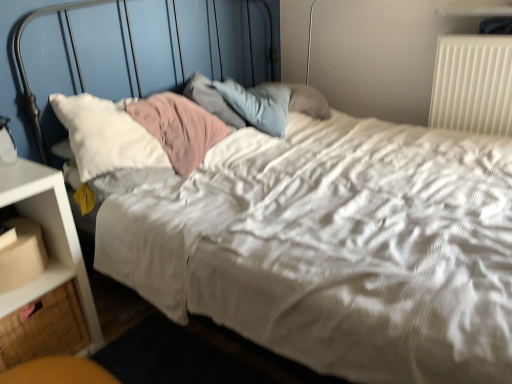
In order to face beige fabric drawer at lower left, should I rotate leftwards or rightwards?

To face it directly, rotate left by 28.556 degrees.

This screenshot has width=512, height=384. I want to click on beige fabric drawer at lower left, so click(x=42, y=328).

In the scene shown: Does beige fabric drawer at lower left have a greater width compared to matte cardboard box at lower left?

Correct, the width of beige fabric drawer at lower left exceeds that of matte cardboard box at lower left.

Is beige fabric drawer at lower left closer to camera compared to matte cardboard box at lower left?

No, beige fabric drawer at lower left is behind matte cardboard box at lower left.

Can you tell me how much beige fabric drawer at lower left and matte cardboard box at lower left differ in facing direction?

They differ by 2.97 degrees in their facing directions.

Is beige fabric drawer at lower left oriented towards matte cardboard box at lower left?

No.

From the picture: Does white plastic nightstand at lower left have a larger size compared to beige fabric drawer at lower left?

Yes, white plastic nightstand at lower left is bigger than beige fabric drawer at lower left.

Are white plastic nightstand at lower left and beige fabric drawer at lower left making contact?

white plastic nightstand at lower left is not next to beige fabric drawer at lower left, and they're not touching.

Consider the image. Is white plastic nightstand at lower left in front of or behind beige fabric drawer at lower left in the image?

white plastic nightstand at lower left is in front of beige fabric drawer at lower left.

Is white plastic nightstand at lower left at the left side of beige fabric drawer at lower left?

No.

Is white plastic radiator at upper right positioned with its back to matte cardboard box at lower left?

No.

Is white plastic radiator at upper right beside matte cardboard box at lower left?

No, white plastic radiator at upper right is not making contact with matte cardboard box at lower left.

Between point (462, 41) and point (63, 204), which one is positioned in front?

The point (63, 204) is closer to the camera.

From the image's perspective, relative to matte cardboard box at lower left, is white plastic radiator at upper right above or below?

From the image's perspective, white plastic radiator at upper right appears above matte cardboard box at lower left.

Is white plastic radiator at upper right inside or outside of white plastic nightstand at lower left?

white plastic radiator at upper right is not inside white plastic nightstand at lower left, it's outside.

Identify the location of nightstand that is on the left side of white plastic radiator at upper right. The width and height of the screenshot is (512, 384). coord(49,240).

Looking at this image, from a real-world perspective, which is physically above, white plastic radiator at upper right or white plastic nightstand at lower left?

From a 3D spatial view, white plastic radiator at upper right is above.

Based on their positions, is white plastic radiator at upper right located to the left or right of white plastic nightstand at lower left?

From the image, it's evident that white plastic radiator at upper right is to the right of white plastic nightstand at lower left.

Considering the sizes of objects matte cardboard box at lower left and white plastic radiator at upper right in the image provided, who is thinner, matte cardboard box at lower left or white plastic radiator at upper right?

white plastic radiator at upper right.

From a real-world perspective, is matte cardboard box at lower left located beneath white plastic radiator at upper right?

Yes, from a real-world perspective, matte cardboard box at lower left is under white plastic radiator at upper right.

Would you say matte cardboard box at lower left is outside white plastic radiator at upper right?

Yes, matte cardboard box at lower left is located beyond the bounds of white plastic radiator at upper right.

Considering the sizes of matte cardboard box at lower left and white plastic radiator at upper right in the image, is matte cardboard box at lower left taller or shorter than white plastic radiator at upper right?

Clearly, matte cardboard box at lower left is shorter compared to white plastic radiator at upper right.

From the picture: Which of these two, white plastic nightstand at lower left or matte cardboard box at lower left, is smaller?

matte cardboard box at lower left is smaller.

Which object is further away from the camera taking this photo, white plastic nightstand at lower left or matte cardboard box at lower left?

matte cardboard box at lower left is further from the camera.

Can we say white plastic nightstand at lower left lies outside matte cardboard box at lower left?

That's correct, white plastic nightstand at lower left is outside of matte cardboard box at lower left.

Is matte cardboard box at lower left surrounding white plastic nightstand at lower left?

No, white plastic nightstand at lower left is located outside of matte cardboard box at lower left.

Considering the relative sizes of matte cardboard box at lower left and white plastic nightstand at lower left in the image provided, is matte cardboard box at lower left bigger than white plastic nightstand at lower left?

No, matte cardboard box at lower left is not bigger than white plastic nightstand at lower left.

Does matte cardboard box at lower left touch white plastic nightstand at lower left?

Yes, matte cardboard box at lower left is in contact with white plastic nightstand at lower left.

Is matte cardboard box at lower left wider or thinner than white plastic nightstand at lower left?

Considering their sizes, matte cardboard box at lower left looks slimmer than white plastic nightstand at lower left.

This screenshot has height=384, width=512. Find the location of `drawer below the matte cardboard box at lower left (from the image's perspective)`. drawer below the matte cardboard box at lower left (from the image's perspective) is located at coordinates (42, 328).

This screenshot has width=512, height=384. In the image, there is a white plastic nightstand at lower left. What are the coordinates of `drawer below it (from a real-world perspective)` in the screenshot? It's located at (42, 328).

Considering their positions, is matte cardboard box at lower left positioned closer to beige fabric drawer at lower left than white plastic radiator at upper right?

matte cardboard box at lower left lies closer to beige fabric drawer at lower left than the other object.

Which object lies further to the anchor point white plastic nightstand at lower left, matte cardboard box at lower left or white plastic radiator at upper right?

The object further to white plastic nightstand at lower left is white plastic radiator at upper right.

Estimate the real-world distances between objects in this image. Which object is further from beige fabric drawer at lower left, white plastic radiator at upper right or matte cardboard box at lower left?

white plastic radiator at upper right is further to beige fabric drawer at lower left.

In the scene shown: When comparing their distances from matte cardboard box at lower left, does white plastic radiator at upper right or beige fabric drawer at lower left seem further?

white plastic radiator at upper right.

Considering their positions, is white plastic radiator at upper right positioned closer to white plastic nightstand at lower left than beige fabric drawer at lower left?

beige fabric drawer at lower left is positioned closer to the anchor white plastic nightstand at lower left.

Considering their positions, is white plastic nightstand at lower left positioned further to white plastic radiator at upper right than beige fabric drawer at lower left?

Among the two, beige fabric drawer at lower left is located further to white plastic radiator at upper right.

When comparing their distances from beige fabric drawer at lower left, does white plastic nightstand at lower left or white plastic radiator at upper right seem further?

Among the two, white plastic radiator at upper right is located further to beige fabric drawer at lower left.

When comparing their distances from white plastic nightstand at lower left, does white plastic radiator at upper right or matte cardboard box at lower left seem closer?

Based on the image, matte cardboard box at lower left appears to be nearer to white plastic nightstand at lower left.

The image size is (512, 384). Find the location of `nightstand between beige fabric drawer at lower left and white plastic radiator at upper right from left to right`. nightstand between beige fabric drawer at lower left and white plastic radiator at upper right from left to right is located at coordinates (49, 240).

Locate an element on the screen. shelf located between white plastic nightstand at lower left and white plastic radiator at upper right in the left-right direction is located at coordinates (48, 246).

This screenshot has width=512, height=384. I want to click on shelf situated between beige fabric drawer at lower left and white plastic radiator at upper right from left to right, so click(48, 246).

Where is `nightstand between matte cardboard box at lower left and beige fabric drawer at lower left from top to bottom`? The height and width of the screenshot is (384, 512). nightstand between matte cardboard box at lower left and beige fabric drawer at lower left from top to bottom is located at coordinates pyautogui.click(x=49, y=240).